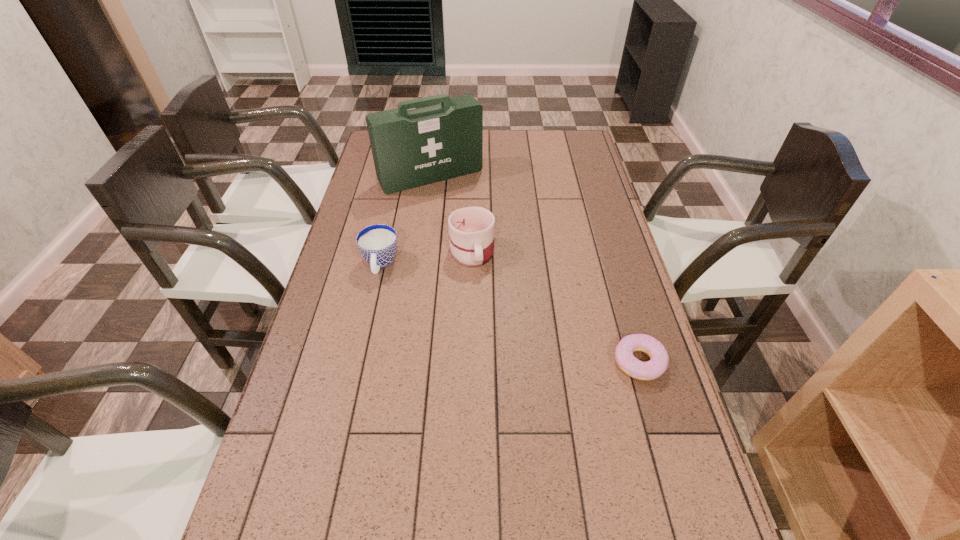
Find the location of a particular element. The image size is (960, 540). vacant space located 0.330m on the front-facing side of the first-aid kit is located at coordinates (489, 248).

At what (x,y) coordinates should I click in order to perform the action: click on vacant area situated on the side with the handle of the mug. Please return your answer as a coordinate pair (x, y). This screenshot has height=540, width=960. Looking at the image, I should click on (489, 359).

Locate an element on the screen. The width and height of the screenshot is (960, 540). blank space located 0.210m on the side with the handle of the mug is located at coordinates (483, 328).

Where is `vacant space positioned on the side with the handle of the mug`? vacant space positioned on the side with the handle of the mug is located at coordinates (492, 387).

This screenshot has height=540, width=960. I want to click on cup present at the left edge, so click(x=377, y=243).

Identify the location of the first-aid kit located at the left edge. The width and height of the screenshot is (960, 540). (411, 148).

Locate an element on the screen. The width and height of the screenshot is (960, 540). object present at the right edge is located at coordinates (657, 365).

At what (x,y) coordinates should I click in order to perform the action: click on free space at the far edge. Please return your answer as a coordinate pair (x, y). This screenshot has height=540, width=960. Looking at the image, I should click on (490, 156).

Identify the location of vacant space at the near edge. (446, 521).

At what (x,y) coordinates should I click in order to perform the action: click on free spot at the left edge of the desktop. Please return your answer as a coordinate pair (x, y). Looking at the image, I should click on (382, 223).